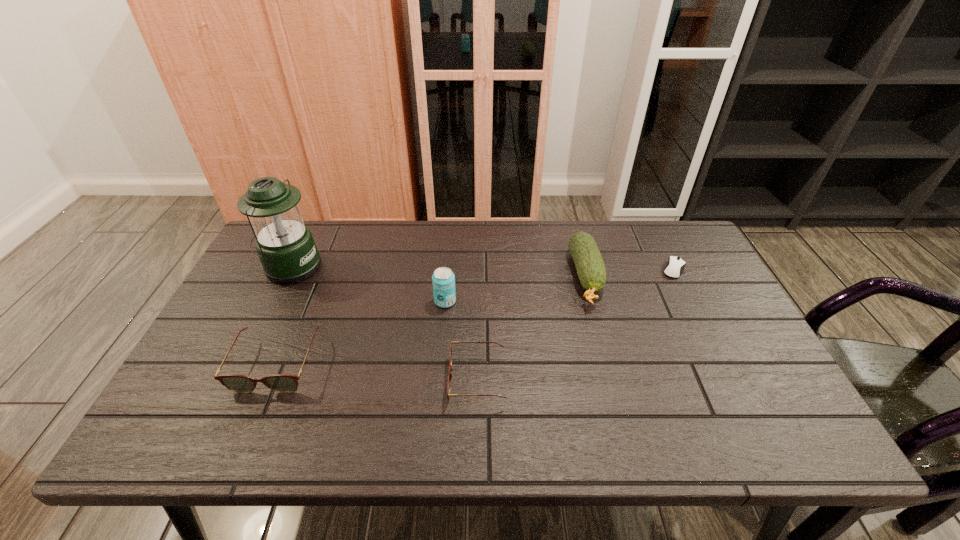
Locate an element on the screen. Image resolution: width=960 pixels, height=540 pixels. vacant space located at the front view of the right spectacles is located at coordinates [x=319, y=380].

Locate an element on the screen. This screenshot has width=960, height=540. free spot located 0.080m at the front view of the right spectacles is located at coordinates (416, 380).

You are a GUI agent. You are given a task and a screenshot of the screen. Output one action in this format:
    pyautogui.click(x=<x>, y=<y>)
    Task: Click on the free location located 0.390m at the front view of the right spectacles
    This screenshot has height=540, width=960.
    Given the screenshot: What is the action you would take?
    pyautogui.click(x=285, y=380)

Where is `vacant space positioned 0.100m on the front of the lantern`? vacant space positioned 0.100m on the front of the lantern is located at coordinates point(270,310).

Locate an element on the screen. The height and width of the screenshot is (540, 960). free region located 0.080m on the right of the second tallest object is located at coordinates (485, 301).

The height and width of the screenshot is (540, 960). I want to click on vacant space located on the back of the shortest object, so click(657, 235).

At what (x,y) coordinates should I click in order to perform the action: click on vacant space situated 0.250m at the blossom end of the fifth object from left to right. Please return your answer as a coordinate pair (x, y). The image size is (960, 540). Looking at the image, I should click on (616, 390).

Find the location of a particular element. lantern situated at the far edge is located at coordinates (285, 245).

Locate an element on the screen. mouse situated at the far edge is located at coordinates (675, 266).

Where is `cucumber positioned at the far edge`? cucumber positioned at the far edge is located at coordinates (590, 267).